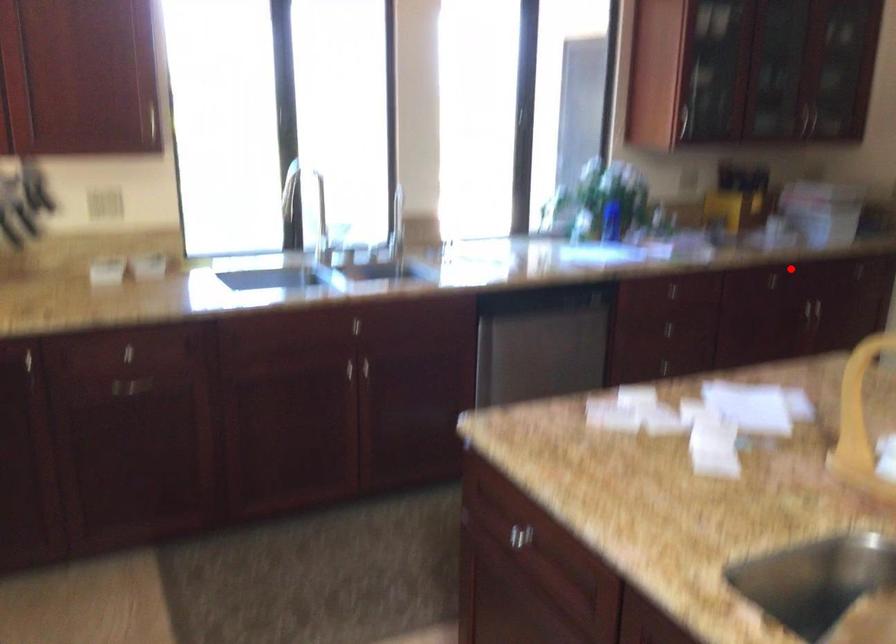
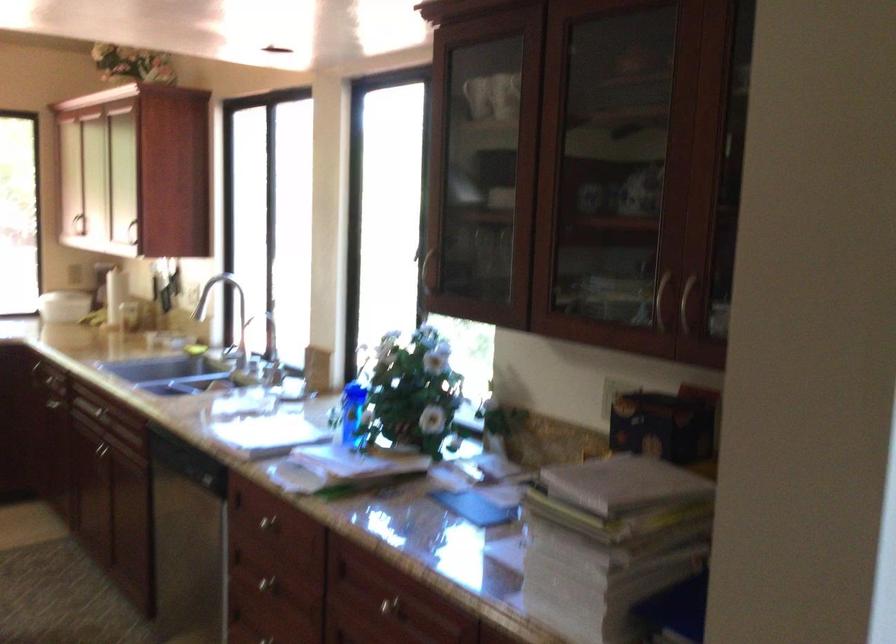
Question: I am providing you with two images of the same scene from different viewpoints. Given a red point in image1, look at the same physical point in image2. Is it:

Choices:
 (A) Closer to the viewpoint
 (B) Farther from the viewpoint

Answer: (A)